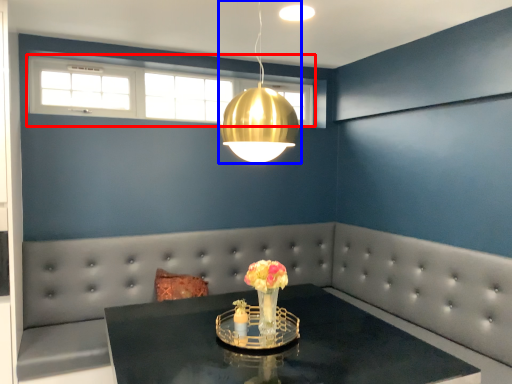
Question: Among these objects, which one is farthest to the camera, window (highlighted by a red box) or lamp (highlighted by a blue box)?

Choices:
 (A) window
 (B) lamp

Answer: (A)